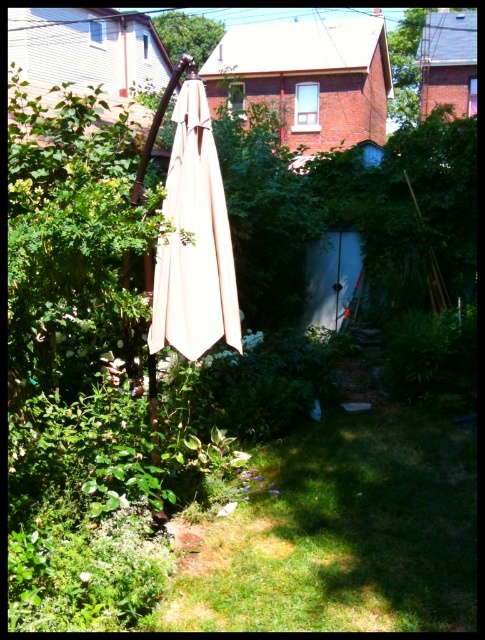
Where is `beige fabric umbrella at center`? beige fabric umbrella at center is located at coordinates click(x=194, y=234).

Where is `beige fabric umbrella at center`? The width and height of the screenshot is (485, 640). beige fabric umbrella at center is located at coordinates (194, 234).